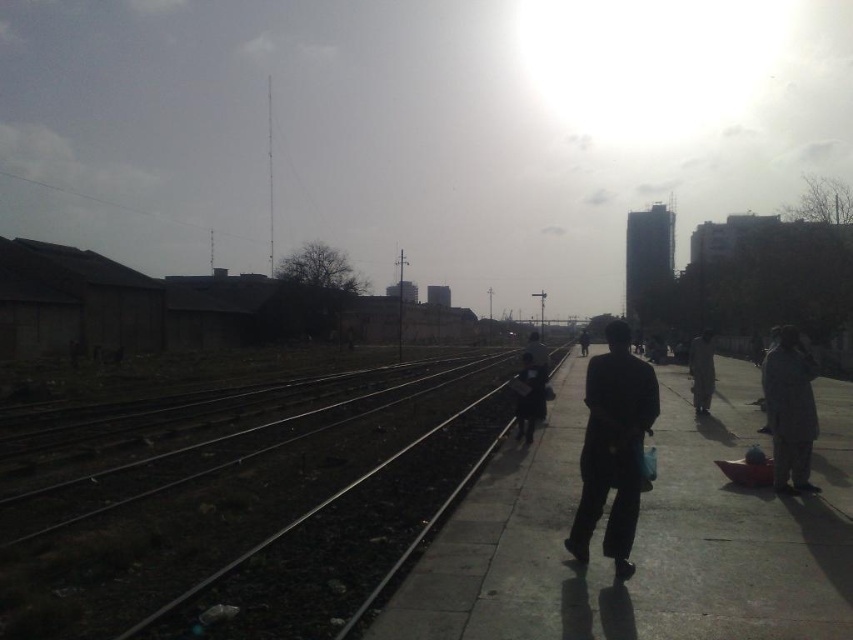
The width and height of the screenshot is (853, 640). Identify the location of dark concrete pavement at center. (643, 538).

Does dark concrete pavement at center appear under dark gray fabric coat at right?

Yes.

What do you see at coordinates (643, 538) in the screenshot?
I see `dark concrete pavement at center` at bounding box center [643, 538].

This screenshot has height=640, width=853. I want to click on dark concrete pavement at center, so click(x=643, y=538).

Does matte black jacket at center come behind dark gray suit at center?

No, matte black jacket at center is in front of dark gray suit at center.

Who is positioned more to the right, matte black jacket at center or dark gray suit at center?

Positioned to the right is dark gray suit at center.

Describe the element at coordinates (538, 369) in the screenshot. I see `matte black jacket at center` at that location.

What are the coordinates of `matte black jacket at center` in the screenshot? It's located at (538, 369).

Can you confirm if black fabric jacket at center is smaller than dark blue jacket at center?

Actually, black fabric jacket at center might be larger than dark blue jacket at center.

Is black fabric jacket at center below dark blue jacket at center?

No.

You are a GUI agent. You are given a task and a screenshot of the screen. Output one action in this format:
    pyautogui.click(x=<x>, y=<y>)
    Task: Click on the black fabric jacket at center
    This screenshot has width=853, height=640.
    Given the screenshot: What is the action you would take?
    pyautogui.click(x=613, y=448)